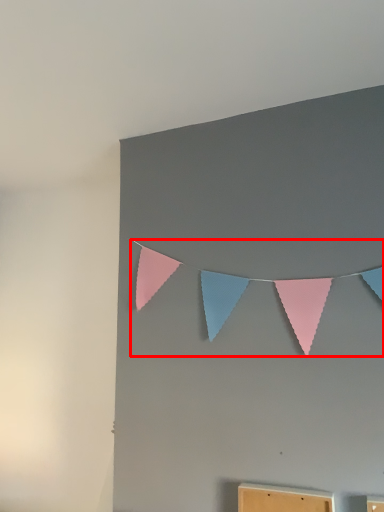
Question: Where is clothesline (annotated by the red box) located in relation to furniture in the image?

Choices:
 (A) right
 (B) left

Answer: (B)